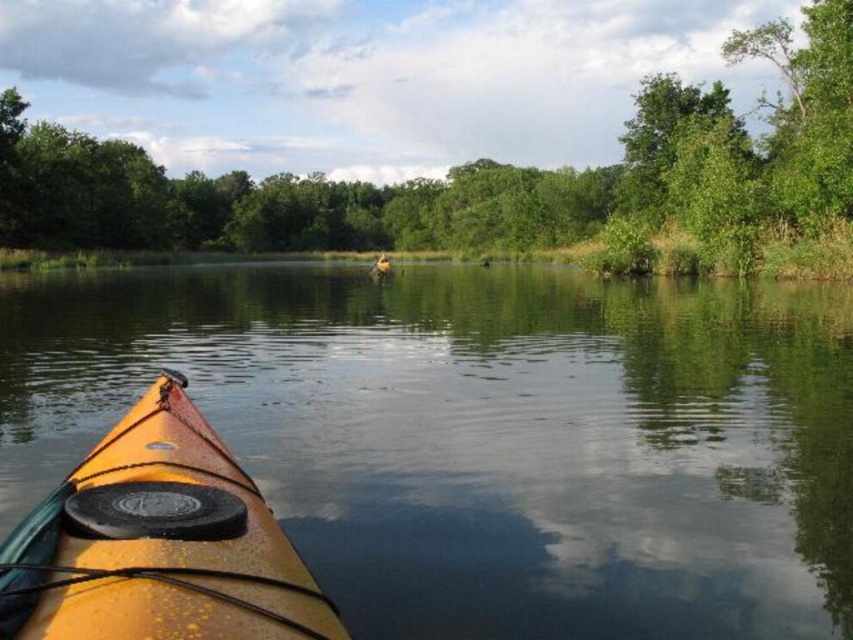
You are an observer looking at the scene. There is a smooth water at center and a green leafy tree at center. Which object appears narrower in the image?

The smooth water at center appears narrower because it is thinner than the green leafy tree at center.